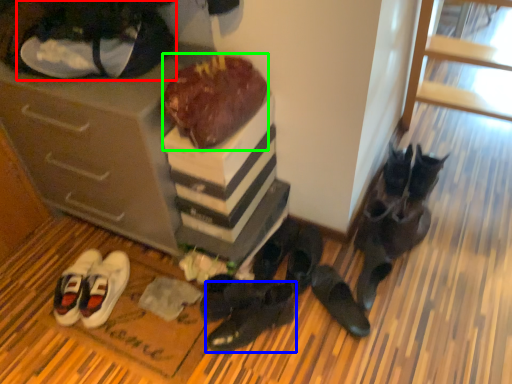
Question: Estimate the real-world distances between objects in this image. Which object is closer to footwear (highlighted by a red box), footwear (highlighted by a blue box) or chocolate cake (highlighted by a green box)?

Choices:
 (A) footwear
 (B) chocolate cake

Answer: (B)